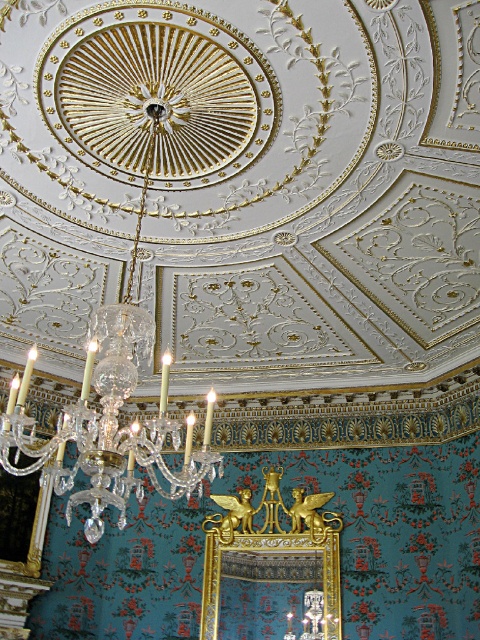
In the scene shown: You are an interior designer assessing the placement of the crystalcandlestick chandelier at center and the gold metallic picture frame at center in a luxurious space. Based on their positions, which object is positioned higher?

The crystalcandlestick chandelier at center is located above the gold metallic picture frame at center, so it is positioned higher.

You are an interior designer assessing the space. You notice the crystalcandlestick chandelier at center and the gold metallic picture frame at center. Which object is shorter in height?

The crystalcandlestick chandelier at center is not as tall as the gold metallic picture frame at center, so the chandelier is shorter.

You are an interior designer planning to hang a new artwork on the wall. The crystal candlestick chandelier at center is currently located at point (108, 424). If you want to place the artwork 10 cm to the right of the chandelier, what coordinate should you aim for?

To place the artwork 10 cm to the right of the crystal candlestick chandelier at center, you should aim for the coordinate (108, 424) plus 10 cm to the right. However, without knowing the scale of the coordinate system, it is impossible to provide an exact numerical coordinate.